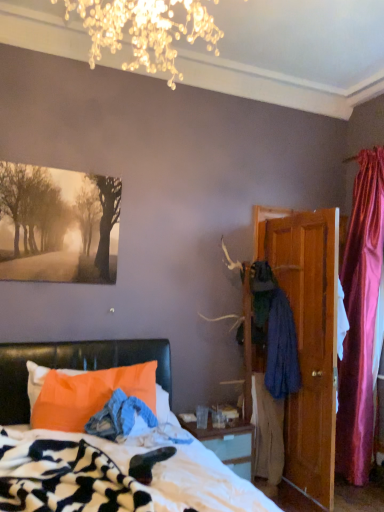
Question: Is matte black painting at upper left positioned far away from orange fabric pillow at lower left?

Choices:
 (A) no
 (B) yes

Answer: (A)

Question: Is orange fabric pillow at lower left located within matte black painting at upper left?

Choices:
 (A) yes
 (B) no

Answer: (B)

Question: From a real-world perspective, does matte black painting at upper left stand above orange fabric pillow at lower left?

Choices:
 (A) yes
 (B) no

Answer: (A)

Question: Does matte black painting at upper left appear on the right side of orange fabric pillow at lower left?

Choices:
 (A) yes
 (B) no

Answer: (B)

Question: Considering the relative sizes of matte black painting at upper left and orange fabric pillow at lower left in the image provided, is matte black painting at upper left thinner than orange fabric pillow at lower left?

Choices:
 (A) yes
 (B) no

Answer: (A)

Question: From the image's perspective, is matte black painting at upper left on top of orange fabric pillow at lower left?

Choices:
 (A) no
 (B) yes

Answer: (B)

Question: Considering the relative positions of wooden door at right and matte black painting at upper left in the image provided, is wooden door at right to the right of matte black painting at upper left from the viewer's perspective?

Choices:
 (A) yes
 (B) no

Answer: (A)

Question: Is wooden door at right positioned far away from matte black painting at upper left?

Choices:
 (A) no
 (B) yes

Answer: (B)

Question: Does wooden door at right come behind matte black painting at upper left?

Choices:
 (A) yes
 (B) no

Answer: (A)

Question: From a real-world perspective, is wooden door at right positioned under matte black painting at upper left based on gravity?

Choices:
 (A) no
 (B) yes

Answer: (B)

Question: Considering the relative positions of wooden door at right and matte black painting at upper left in the image provided, is wooden door at right to the left of matte black painting at upper left from the viewer's perspective?

Choices:
 (A) yes
 (B) no

Answer: (B)

Question: Is wooden door at right aimed at matte black painting at upper left?

Choices:
 (A) no
 (B) yes

Answer: (A)

Question: Can you confirm if dark blue fabric coat at right is wider than wooden door at right?

Choices:
 (A) no
 (B) yes

Answer: (A)